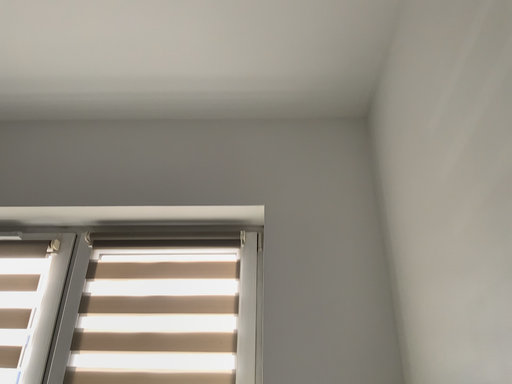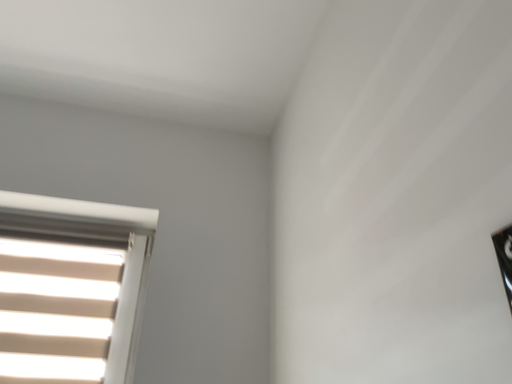
Question: How did the camera likely rotate when shooting the video?

Choices:
 (A) rotated right
 (B) rotated left

Answer: (A)